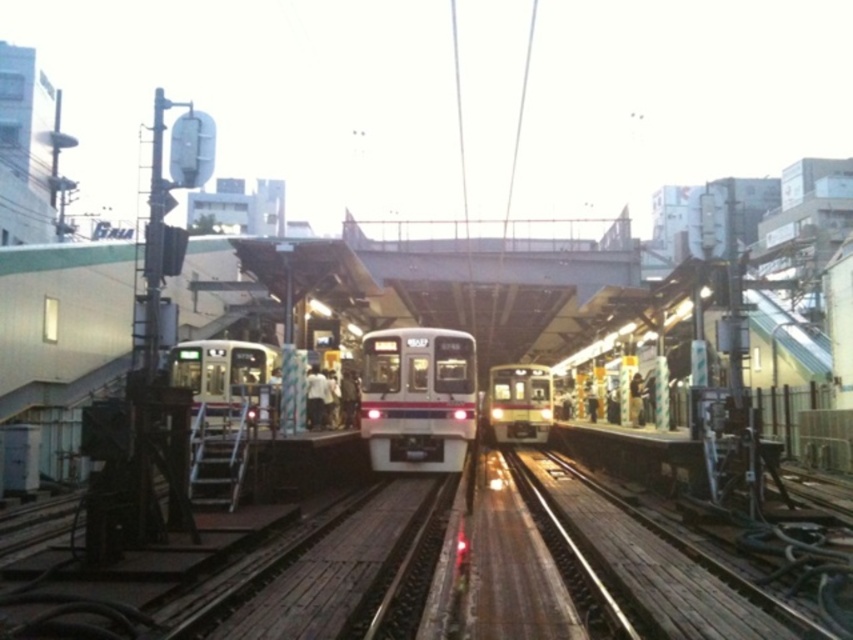
You are standing at the point marked by coordinates point (416, 397). What object are you directly in front of?

You are directly in front of the silver metallic train at center, as the point (416, 397) represents its location.